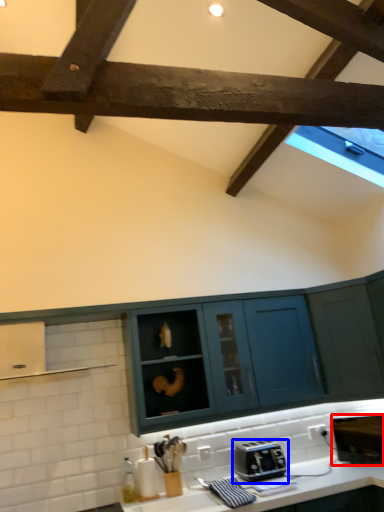
Question: Which of the following is the closest to the observer, appliance (highlighted by a red box) or toaster (highlighted by a blue box)?

Choices:
 (A) appliance
 (B) toaster

Answer: (B)